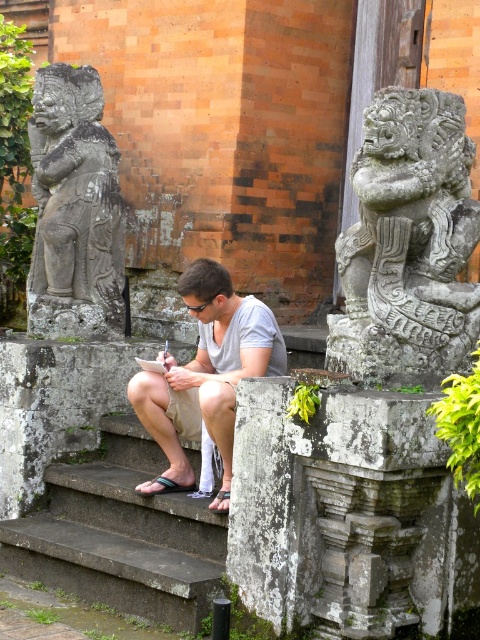
Does gray stone statue at left have a lesser width compared to white cotton shirt at center?

Yes.

Image resolution: width=480 pixels, height=640 pixels. Identify the location of gray stone statue at left. (74, 209).

Is carved stone lion at upper right smaller than gray stone statue at left?

Actually, carved stone lion at upper right might be larger than gray stone statue at left.

Does carved stone lion at upper right have a greater width compared to gray stone statue at left?

Yes.

Describe the element at coordinates (408, 244) in the screenshot. I see `carved stone lion at upper right` at that location.

Where is `carved stone lion at upper right`? carved stone lion at upper right is located at coordinates (408, 244).

Can you confirm if dark gray stone stairs at center is positioned below white cotton shirt at center?

Correct, dark gray stone stairs at center is located below white cotton shirt at center.

Is point (46, 500) positioned behind point (168, 362)?

That is True.

Between point (183, 500) and point (197, 349), which one is positioned behind?

The point (197, 349) is more distant.

The height and width of the screenshot is (640, 480). What are the coordinates of `dark gray stone stairs at center` in the screenshot? It's located at (120, 536).